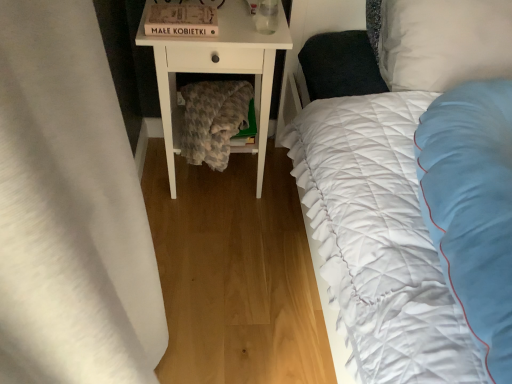
Question: Considering the relative sizes of white fabric curtain at left and white soft pillow at upper right in the image provided, is white fabric curtain at left taller than white soft pillow at upper right?

Choices:
 (A) yes
 (B) no

Answer: (A)

Question: From a real-world perspective, is white fabric curtain at left positioned over white soft pillow at upper right based on gravity?

Choices:
 (A) no
 (B) yes

Answer: (A)

Question: From the image's perspective, is white fabric curtain at left over white soft pillow at upper right?

Choices:
 (A) no
 (B) yes

Answer: (A)

Question: Considering the relative positions of white fabric curtain at left and white soft pillow at upper right in the image provided, is white fabric curtain at left in front of white soft pillow at upper right?

Choices:
 (A) no
 (B) yes

Answer: (B)

Question: From a real-world perspective, is white fabric curtain at left positioned under white soft pillow at upper right based on gravity?

Choices:
 (A) no
 (B) yes

Answer: (B)

Question: Is the surface of white fabric curtain at left in direct contact with white soft pillow at upper right?

Choices:
 (A) no
 (B) yes

Answer: (A)

Question: Is clear glass at upper center to the right of white quilted bed at right from the viewer's perspective?

Choices:
 (A) yes
 (B) no

Answer: (B)

Question: From the image's perspective, is clear glass at upper center below white quilted bed at right?

Choices:
 (A) no
 (B) yes

Answer: (A)

Question: Is the position of clear glass at upper center less distant than that of white quilted bed at right?

Choices:
 (A) no
 (B) yes

Answer: (A)

Question: Considering the relative positions of clear glass at upper center and white quilted bed at right in the image provided, is clear glass at upper center to the left of white quilted bed at right from the viewer's perspective?

Choices:
 (A) yes
 (B) no

Answer: (A)

Question: Is clear glass at upper center not inside white quilted bed at right?

Choices:
 (A) yes
 (B) no

Answer: (A)

Question: Is clear glass at upper center wider than white quilted bed at right?

Choices:
 (A) yes
 (B) no

Answer: (B)

Question: Is clear glass at upper center at the left side of white soft pillow at upper right?

Choices:
 (A) no
 (B) yes

Answer: (B)